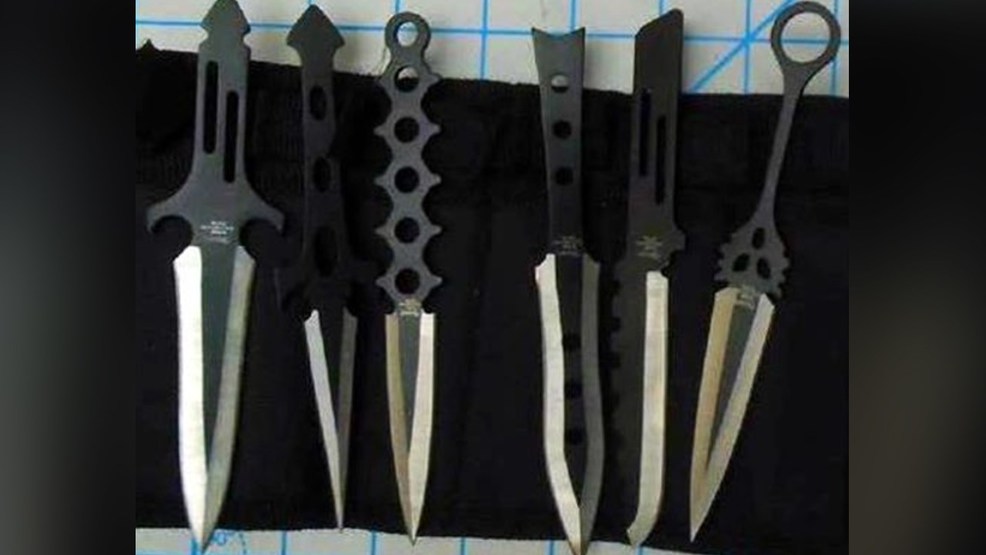
Where is `corner`? corner is located at coordinates (963, 539), (15, 539), (23, 11), (971, 16).